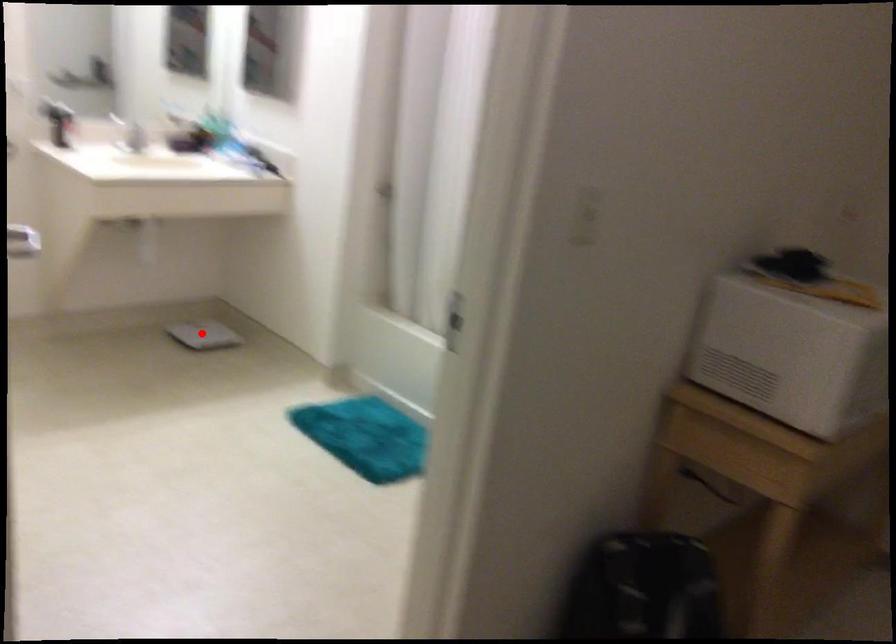
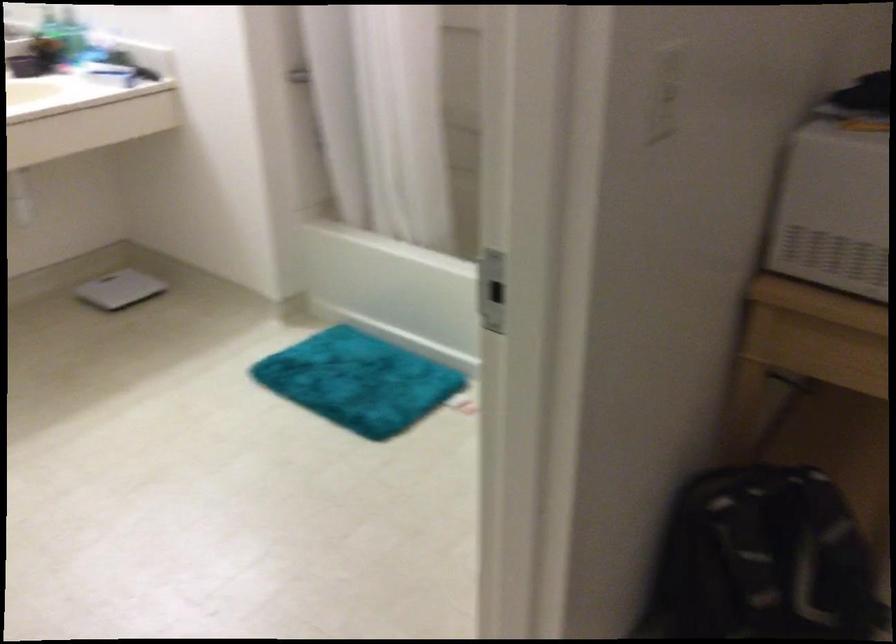
Where in the second image is the point corresponding to the highlighted location from the first image?

(119, 289)